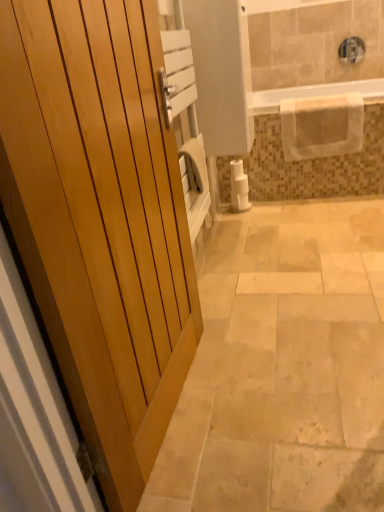
Question: Is white matte toilet paper at center-right outside of wooden door at left?

Choices:
 (A) yes
 (B) no

Answer: (A)

Question: Considering the relative positions of white matte toilet paper at center-right and wooden door at left in the image provided, is white matte toilet paper at center-right to the left of wooden door at left from the viewer's perspective?

Choices:
 (A) yes
 (B) no

Answer: (B)

Question: Is white matte toilet paper at center-right far from wooden door at left?

Choices:
 (A) no
 (B) yes

Answer: (B)

Question: Can you confirm if white matte toilet paper at center-right is smaller than wooden door at left?

Choices:
 (A) no
 (B) yes

Answer: (B)

Question: From the image's perspective, is white matte toilet paper at center-right below wooden door at left?

Choices:
 (A) no
 (B) yes

Answer: (A)

Question: Is point (72, 284) closer or farther from the camera than point (281, 88)?

Choices:
 (A) farther
 (B) closer

Answer: (B)

Question: Is wooden door at left spatially inside clear plastic bathtub at upper center, or outside of it?

Choices:
 (A) outside
 (B) inside

Answer: (A)

Question: In the image, is wooden door at left on the left side or the right side of clear plastic bathtub at upper center?

Choices:
 (A) right
 (B) left

Answer: (B)

Question: From a real-world perspective, relative to clear plastic bathtub at upper center, is wooden door at left vertically above or below?

Choices:
 (A) above
 (B) below

Answer: (A)

Question: From the image's perspective, relative to white matte toilet paper at center-right, is wooden door at left above or below?

Choices:
 (A) below
 (B) above

Answer: (A)

Question: Considering their positions, is wooden door at left located in front of or behind white matte toilet paper at center-right?

Choices:
 (A) behind
 (B) front

Answer: (B)

Question: In terms of height, does wooden door at left look taller or shorter compared to white matte toilet paper at center-right?

Choices:
 (A) tall
 (B) short

Answer: (A)

Question: Based on their sizes in the image, would you say wooden door at left is bigger or smaller than white matte toilet paper at center-right?

Choices:
 (A) small
 (B) big

Answer: (B)

Question: Visually, is clear plastic bathtub at upper center positioned to the left or to the right of wooden door at left?

Choices:
 (A) right
 (B) left

Answer: (A)

Question: From the image's perspective, is clear plastic bathtub at upper center above or below wooden door at left?

Choices:
 (A) below
 (B) above

Answer: (B)